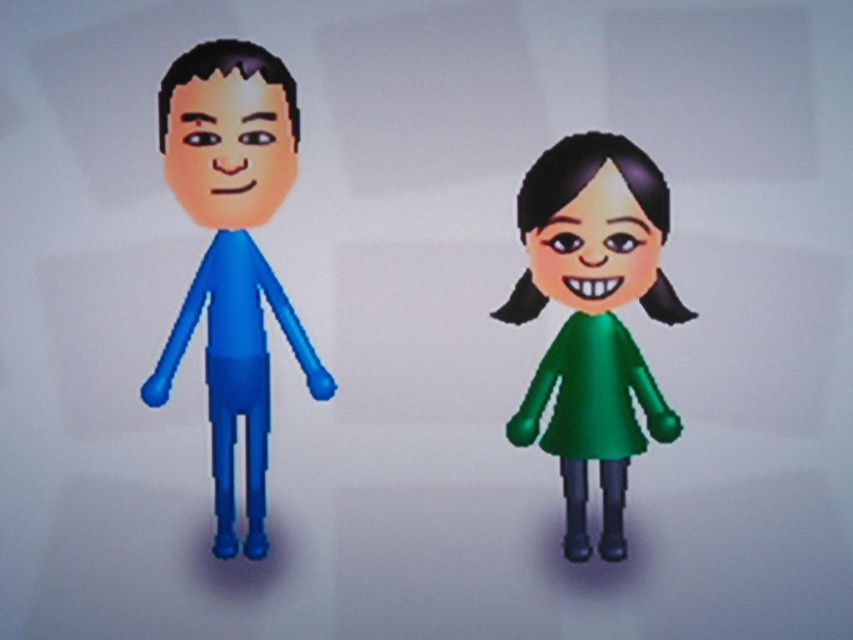
This screenshot has width=853, height=640. Find the location of `matte orange face at left`. matte orange face at left is located at coordinates (228, 148).

Is matte orange face at left to the right of green matte face at right from the viewer's perspective?

In fact, matte orange face at left is to the left of green matte face at right.

Is point (260, 202) positioned behind point (639, 282)?

Yes, it is.

The image size is (853, 640). What are the coordinates of `matte orange face at left` in the screenshot? It's located at (228, 148).

Is point (180, 308) positioned in front of point (555, 216)?

No.

Between blue rubber doll at left and green matte face at right, which one has more height?

With more height is blue rubber doll at left.

What do you see at coordinates (231, 253) in the screenshot? The height and width of the screenshot is (640, 853). I see `blue rubber doll at left` at bounding box center [231, 253].

The image size is (853, 640). I want to click on blue rubber doll at left, so click(x=231, y=253).

Is point (622, 266) less distant than point (251, 164)?

That is True.

Does green matte dress at right have a greater height compared to blue rubber doll at left?

In fact, green matte dress at right may be shorter than blue rubber doll at left.

Image resolution: width=853 pixels, height=640 pixels. What do you see at coordinates (593, 317) in the screenshot?
I see `green matte dress at right` at bounding box center [593, 317].

Locate an element on the screen. This screenshot has width=853, height=640. green matte dress at right is located at coordinates (593, 317).